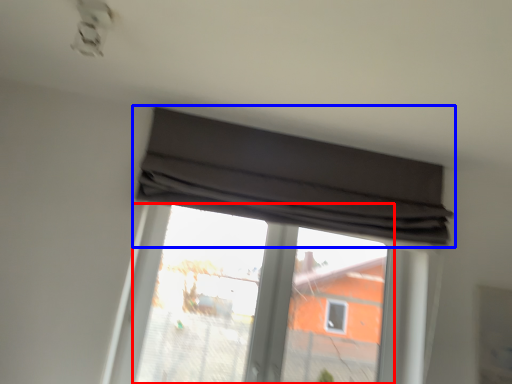
Question: Which point is further to the camera, bay window (highlighted by a red box) or window (highlighted by a blue box)?

Choices:
 (A) bay window
 (B) window

Answer: (A)